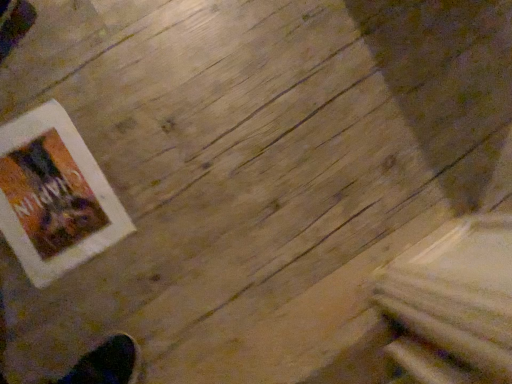
This screenshot has height=384, width=512. I want to click on vacant area in front of white matte picture frame at lower left, so click(x=40, y=316).